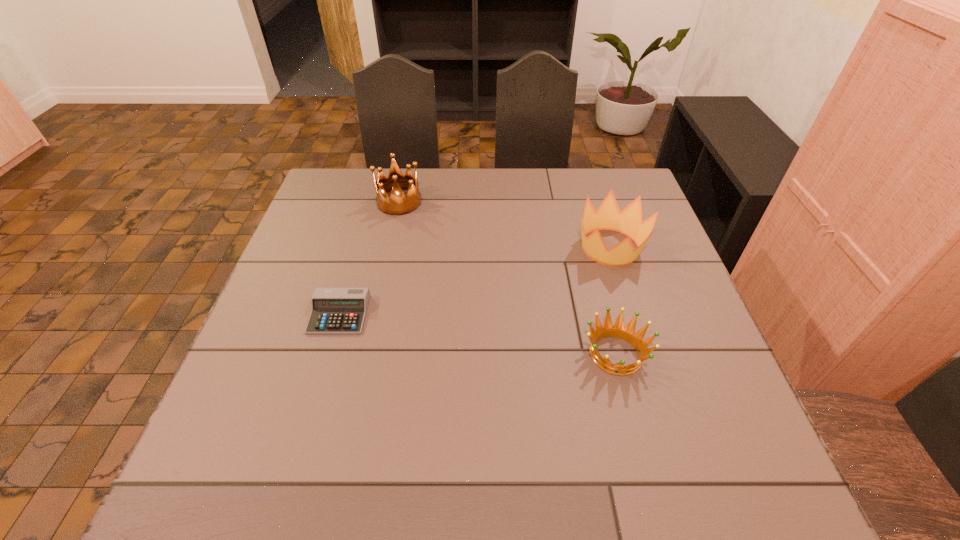
Locate an element on the screen. The height and width of the screenshot is (540, 960). blank space that satisfies the following two spatial constraints: 1. on the back side of the shortest object; 2. on the right side of the third nearest object is located at coordinates (359, 247).

Where is `free space in the image that satisfies the following two spatial constraints: 1. on the front side of the third nearest object; 2. on the left side of the farthest object`? free space in the image that satisfies the following two spatial constraints: 1. on the front side of the third nearest object; 2. on the left side of the farthest object is located at coordinates (389, 247).

Identify the location of vacant space that satisfies the following two spatial constraints: 1. on the back side of the nearest crown; 2. on the right side of the third nearest object. The width and height of the screenshot is (960, 540). (588, 247).

The image size is (960, 540). In order to click on vacant space that satisfies the following two spatial constraints: 1. on the back side of the calculator; 2. on the right side of the third nearest object in this screenshot , I will do `click(359, 247)`.